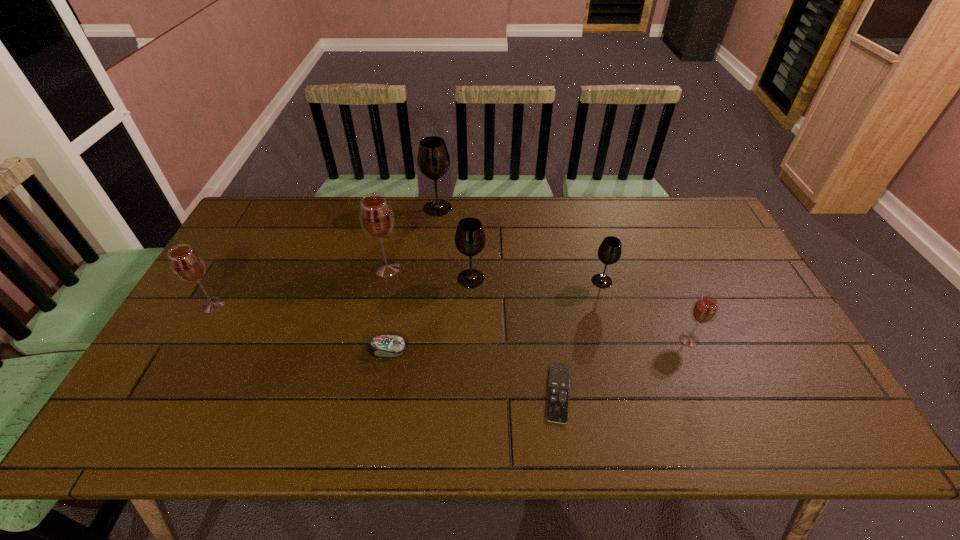
I want to click on the farthest object, so tap(433, 159).

What are the coordinates of `the farthest wineglass` in the screenshot? It's located at (433, 159).

Where is `the fifth wineglass from right to left`? This screenshot has height=540, width=960. the fifth wineglass from right to left is located at coordinates (376, 216).

This screenshot has width=960, height=540. I want to click on the biggest red wineglass, so click(x=376, y=216).

The height and width of the screenshot is (540, 960). I want to click on the fifth farthest object, so click(x=187, y=264).

Find the location of a particular element. The width and height of the screenshot is (960, 540). the leftmost red wineglass is located at coordinates tap(187, 264).

This screenshot has height=540, width=960. Find the location of `the second biggest gray wineglass`. the second biggest gray wineglass is located at coordinates (470, 239).

This screenshot has width=960, height=540. In order to click on the fourth object from right to left in this screenshot , I will do `click(470, 239)`.

Where is `the nearest red wineglass`? Image resolution: width=960 pixels, height=540 pixels. the nearest red wineglass is located at coordinates (705, 309).

You are a GUI agent. You are given a task and a screenshot of the screen. Output one action in this format:
    pyautogui.click(x=<x>, y=<y>)
    Task: Click on the rightmost red wineglass
    Image resolution: width=960 pixels, height=540 pixels.
    Given the screenshot: What is the action you would take?
    pyautogui.click(x=705, y=309)